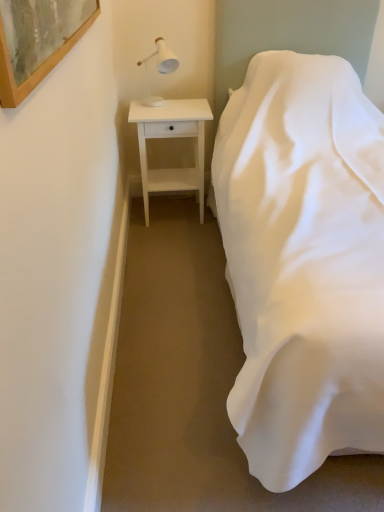
You are a GUI agent. You are given a task and a screenshot of the screen. Output one action in this format:
    pyautogui.click(x=<x>, y=<y>)
    Task: Click on the wooden-framed artwork at upper left
    The height and width of the screenshot is (512, 384).
    Given the screenshot: What is the action you would take?
    pyautogui.click(x=37, y=41)

Image resolution: width=384 pixels, height=512 pixels. In order to click on white matte table lamp at upper left in this screenshot , I will do `click(163, 57)`.

Identify the location of wooden-framed artwork at upper left. Image resolution: width=384 pixels, height=512 pixels. click(x=37, y=41).

Is white wood nightstand at left to the left or to the right of wooden-framed artwork at upper left in the image?

white wood nightstand at left is to the right of wooden-framed artwork at upper left.

Is white wood nightstand at left not near wooden-framed artwork at upper left?

Indeed, white wood nightstand at left is not near wooden-framed artwork at upper left.

From the image's perspective, which one is positioned higher, white wood nightstand at left or wooden-framed artwork at upper left?

wooden-framed artwork at upper left is shown above in the image.

Can you tell me how much white wood nightstand at left and wooden-framed artwork at upper left differ in facing direction?

The facing directions of white wood nightstand at left and wooden-framed artwork at upper left are 89.4 degrees apart.

Is white satin bed at right not close to white wood nightstand at left?

No, white satin bed at right is not far from white wood nightstand at left.

Measure the distance between white satin bed at right and white wood nightstand at left.

A distance of 75.24 centimeters exists between white satin bed at right and white wood nightstand at left.

Is white satin bed at right shorter than white wood nightstand at left?

No.

Which is further, (162, 61) or (320, 376)?

The point (162, 61) is behind.

From a real-world perspective, between white matte table lamp at upper left and white satin bed at right, who is vertically lower?

white satin bed at right, from a real-world perspective.

Is white matte table lamp at upper left not inside white satin bed at right?

Absolutely, white matte table lamp at upper left is external to white satin bed at right.

Which object is further away from the camera taking this photo, white matte table lamp at upper left or white satin bed at right?

white matte table lamp at upper left is further from the camera.

Could you tell me if wooden-framed artwork at upper left is facing white satin bed at right?

Yes, wooden-framed artwork at upper left faces towards white satin bed at right.

Relative to white satin bed at right, is wooden-framed artwork at upper left in front or behind?

In the image, wooden-framed artwork at upper left appears behind white satin bed at right.

Is wooden-framed artwork at upper left spatially inside white satin bed at right, or outside of it?

wooden-framed artwork at upper left is spatially situated outside white satin bed at right.

From a real-world perspective, does white wood nightstand at left stand above white satin bed at right?

No, from a real-world perspective, white wood nightstand at left is not on top of white satin bed at right.

Does white wood nightstand at left have a lesser width compared to white satin bed at right?

Indeed, white wood nightstand at left has a lesser width compared to white satin bed at right.

The width and height of the screenshot is (384, 512). What are the coordinates of `nightstand above the white satin bed at right (from the image's perspective)` in the screenshot? It's located at (172, 137).

Which object is positioned more to the right, white wood nightstand at left or white satin bed at right?

From the viewer's perspective, white satin bed at right appears more on the right side.

Does white satin bed at right appear on the right side of wooden-framed artwork at upper left?

Indeed, white satin bed at right is positioned on the right side of wooden-framed artwork at upper left.

Is wooden-framed artwork at upper left at the back of white satin bed at right?

white satin bed at right does not have its back to wooden-framed artwork at upper left.

Can you confirm if white satin bed at right is wider than wooden-framed artwork at upper left?

Indeed, white satin bed at right has a greater width compared to wooden-framed artwork at upper left.

Considering the relative sizes of white satin bed at right and wooden-framed artwork at upper left in the image provided, is white satin bed at right shorter than wooden-framed artwork at upper left?

No.

Considering the sizes of objects white matte table lamp at upper left and wooden-framed artwork at upper left in the image provided, who is taller, white matte table lamp at upper left or wooden-framed artwork at upper left?

With more height is white matte table lamp at upper left.

Considering the relative positions of white matte table lamp at upper left and wooden-framed artwork at upper left in the image provided, is white matte table lamp at upper left to the left of wooden-framed artwork at upper left from the viewer's perspective?

In fact, white matte table lamp at upper left is to the right of wooden-framed artwork at upper left.

How many degrees apart are the facing directions of white matte table lamp at upper left and wooden-framed artwork at upper left?

The facing directions of white matte table lamp at upper left and wooden-framed artwork at upper left are 89.4 degrees apart.

Looking at this image, considering the relative positions of white matte table lamp at upper left and wooden-framed artwork at upper left in the image provided, is white matte table lamp at upper left in front of wooden-framed artwork at upper left?

No, white matte table lamp at upper left is further to the viewer.

Identify the location of nightstand on the right of wooden-framed artwork at upper left. The image size is (384, 512). (172, 137).

There is a white wood nightstand at left. At what (x,y) coordinates should I click in order to perform the action: click on bed above it (from a real-world perspective). Please return your answer as a coordinate pair (x, y). The width and height of the screenshot is (384, 512). Looking at the image, I should click on (303, 262).

Looking at the image, which one is located closer to wooden-framed artwork at upper left, white wood nightstand at left or white matte table lamp at upper left?

Among the two, white wood nightstand at left is located nearer to wooden-framed artwork at upper left.

Looking at the image, which one is located further to wooden-framed artwork at upper left, white satin bed at right or white matte table lamp at upper left?

Based on the image, white matte table lamp at upper left appears to be further to wooden-framed artwork at upper left.

When comparing their distances from white satin bed at right, does white wood nightstand at left or wooden-framed artwork at upper left seem closer?

white wood nightstand at left.

Which object lies nearer to the anchor point white satin bed at right, wooden-framed artwork at upper left or white matte table lamp at upper left?

Based on the image, wooden-framed artwork at upper left appears to be nearer to white satin bed at right.

Considering their positions, is wooden-framed artwork at upper left positioned further to white wood nightstand at left than white satin bed at right?

Among the two, wooden-framed artwork at upper left is located further to white wood nightstand at left.

Which object lies further to the anchor point wooden-framed artwork at upper left, white matte table lamp at upper left or white wood nightstand at left?

Based on the image, white matte table lamp at upper left appears to be further to wooden-framed artwork at upper left.

Which object lies further to the anchor point white wood nightstand at left, white satin bed at right or wooden-framed artwork at upper left?

wooden-framed artwork at upper left lies further to white wood nightstand at left than the other object.

Looking at the image, which one is located further to white matte table lamp at upper left, white satin bed at right or wooden-framed artwork at upper left?

wooden-framed artwork at upper left is positioned further to the anchor white matte table lamp at upper left.

What are the coordinates of `picture frame between white satin bed at right and white wood nightstand at left in the front-back direction` in the screenshot? It's located at (37, 41).

Find the location of a particular element. table lamp between white satin bed at right and white wood nightstand at left in the front-back direction is located at coordinates (163, 57).

Locate an element on the screen. This screenshot has height=512, width=384. picture frame located between white satin bed at right and white matte table lamp at upper left in the depth direction is located at coordinates click(x=37, y=41).

What are the coordinates of `table lamp located between wooden-framed artwork at upper left and white wood nightstand at left in the depth direction` in the screenshot? It's located at (163, 57).